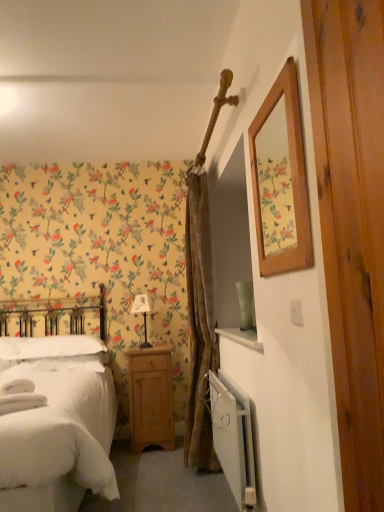
What are the coordinates of `brown textured curtain at center` in the screenshot? It's located at (199, 324).

This screenshot has height=512, width=384. What do you see at coordinates (143, 313) in the screenshot?
I see `white fabric lampshade at center` at bounding box center [143, 313].

Identify the location of white fabric lampshade at center. (143, 313).

What do you see at coordinates (49, 347) in the screenshot? The width and height of the screenshot is (384, 512). I see `white soft pillow at left` at bounding box center [49, 347].

Find the location of a particular element. The image size is (384, 512). brown textured curtain at center is located at coordinates (199, 324).

Which object is further away from the camera taking this photo, brown textured curtain at center or white soft bed at left?

Positioned behind is brown textured curtain at center.

Is brown textured curtain at center situated inside white soft bed at left or outside?

brown textured curtain at center is located beyond the bounds of white soft bed at left.

Is brown textured curtain at center far from white soft bed at left?

No, there isn't a large distance between brown textured curtain at center and white soft bed at left.

Which object is wider, brown textured curtain at center or white soft bed at left?

Wider between the two is white soft bed at left.

Considering the sizes of objects white fabric lampshade at center and light brown wood nightstand at lower center in the image provided, who is smaller, white fabric lampshade at center or light brown wood nightstand at lower center?

With smaller size is white fabric lampshade at center.

What's the angular difference between white fabric lampshade at center and light brown wood nightstand at lower center's facing directions?

The facing directions of white fabric lampshade at center and light brown wood nightstand at lower center are 29.3 degrees apart.

Could you measure the distance between white fabric lampshade at center and light brown wood nightstand at lower center?

white fabric lampshade at center and light brown wood nightstand at lower center are 20.41 inches apart.

Is light brown wood nightstand at lower center inside white fabric lampshade at center?

No, light brown wood nightstand at lower center is not surrounded by white fabric lampshade at center.

In the scene shown: Is white soft bed at left positioned in front of white soft pillow at left?

Yes.

Does white soft bed at left have a greater width compared to white soft pillow at left?

Correct, the width of white soft bed at left exceeds that of white soft pillow at left.

From a real-world perspective, which is physically above, white soft bed at left or white soft pillow at left?

white soft pillow at left is physically above.

Can you tell me how much white soft bed at left and white soft pillow at left differ in facing direction?

They differ by 3.61e-05 degrees in their facing directions.

Does point (149, 307) appear closer or farther from the camera than point (194, 421)?

Point (149, 307).

From the image's perspective, who appears lower, white fabric lampshade at center or brown textured curtain at center?

From the image's view, white fabric lampshade at center is below.

Is brown textured curtain at center completely or partially inside white fabric lampshade at center?

Definitely not — brown textured curtain at center is not inside white fabric lampshade at center.

Is light brown wood nightstand at lower center to the right of white soft bed at left from the viewer's perspective?

Correct, you'll find light brown wood nightstand at lower center to the right of white soft bed at left.

Consider the image. From a real-world perspective, is light brown wood nightstand at lower center on white soft bed at left?

No, from a real-world perspective, light brown wood nightstand at lower center is not over white soft bed at left

Can you confirm if light brown wood nightstand at lower center is smaller than white soft bed at left?

Indeed, light brown wood nightstand at lower center has a smaller size compared to white soft bed at left.

Based on the photo, considering the positions of objects white soft pillow at left and light brown wood nightstand at lower center in the image provided, who is more to the left, white soft pillow at left or light brown wood nightstand at lower center?

white soft pillow at left is more to the left.

Is white soft pillow at left facing towards light brown wood nightstand at lower center?

No, white soft pillow at left is not turned towards light brown wood nightstand at lower center.

From a real-world perspective, is white soft pillow at left positioned above or below light brown wood nightstand at lower center?

white soft pillow at left is above light brown wood nightstand at lower center.

Is point (144, 309) in front of point (226, 375)?

That is False.

Considering the relative positions of white fabric lampshade at center and white metallic radiator at lower right in the image provided, is white fabric lampshade at center to the left or to the right of white metallic radiator at lower right?

Clearly, white fabric lampshade at center is on the left of white metallic radiator at lower right in the image.

In terms of width, does white fabric lampshade at center look wider or thinner when compared to white metallic radiator at lower right?

Considering their sizes, white fabric lampshade at center looks broader than white metallic radiator at lower right.

Would you say white fabric lampshade at center is a long distance from white metallic radiator at lower right?

Yes, white fabric lampshade at center and white metallic radiator at lower right are located far from each other.

The image size is (384, 512). I want to click on bed in front of the brown textured curtain at center, so click(57, 416).

Find the location of a particular element. This screenshot has height=512, width=384. table lamp on the left of light brown wood nightstand at lower center is located at coordinates (143, 313).

Based on their spatial positions, is white metallic radiator at lower right or white fabric lampshade at center further from brown textured curtain at center?

Among the two, white fabric lampshade at center is located further to brown textured curtain at center.

Consider the image. Looking at the image, which one is located further to white soft pillow at left, white fabric lampshade at center or light brown wood nightstand at lower center?

white fabric lampshade at center lies further to white soft pillow at left than the other object.

Estimate the real-world distances between objects in this image. Which object is closer to white metallic radiator at lower right, brown textured curtain at center or white soft bed at left?

brown textured curtain at center is closer to white metallic radiator at lower right.

Which object lies further to the anchor point white metallic radiator at lower right, brown textured curtain at center or white fabric lampshade at center?

white fabric lampshade at center.

Estimate the real-world distances between objects in this image. Which object is closer to light brown wood nightstand at lower center, white soft bed at left or white fabric lampshade at center?

Among the two, white fabric lampshade at center is located nearer to light brown wood nightstand at lower center.

Looking at this image, looking at the image, which one is located further to white metallic radiator at lower right, light brown wood nightstand at lower center or white soft bed at left?

The object further to white metallic radiator at lower right is light brown wood nightstand at lower center.

Considering their positions, is white soft bed at left positioned closer to white fabric lampshade at center than light brown wood nightstand at lower center?

Among the two, light brown wood nightstand at lower center is located nearer to white fabric lampshade at center.

Looking at the image, which one is located closer to light brown wood nightstand at lower center, white soft pillow at left or white metallic radiator at lower right?

white soft pillow at left is positioned closer to the anchor light brown wood nightstand at lower center.

Find the location of a particular element. Image resolution: width=384 pixels, height=512 pixels. nightstand between white soft pillow at left and brown textured curtain at center from left to right is located at coordinates (150, 399).

Identify the location of table lamp located between white soft pillow at left and light brown wood nightstand at lower center in the left-right direction. The height and width of the screenshot is (512, 384). tap(143, 313).

Find the location of a particular element. radiator between white soft bed at left and light brown wood nightstand at lower center along the z-axis is located at coordinates (233, 438).

The height and width of the screenshot is (512, 384). Identify the location of pillow located between white metallic radiator at lower right and light brown wood nightstand at lower center in the depth direction. (49, 347).